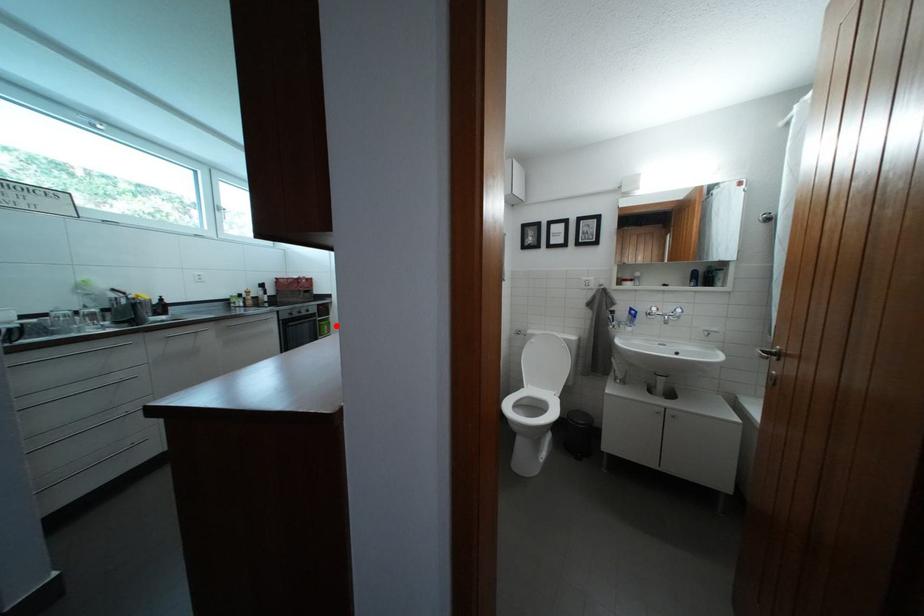
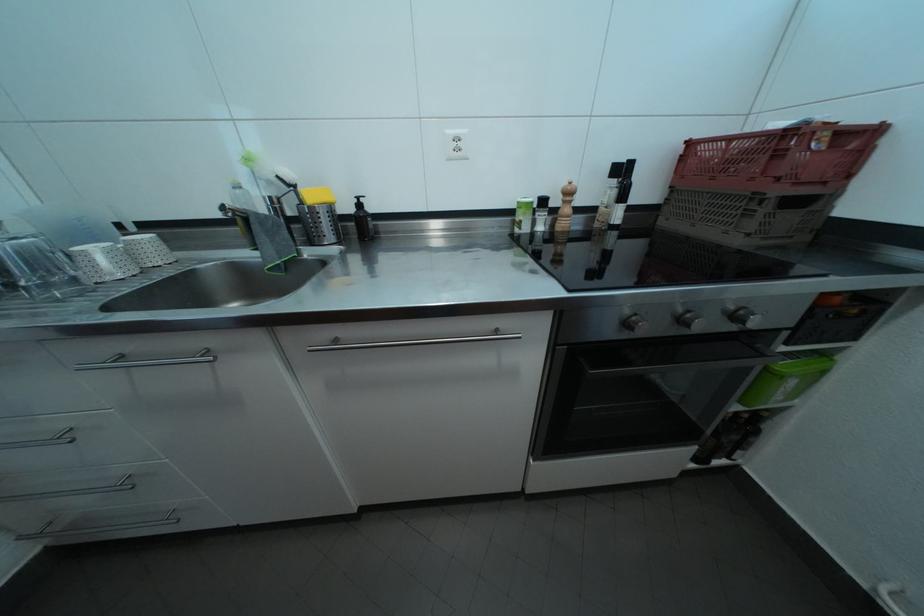
In the second image, find the point that corresponds to the highlighted location in the first image.

(833, 360)